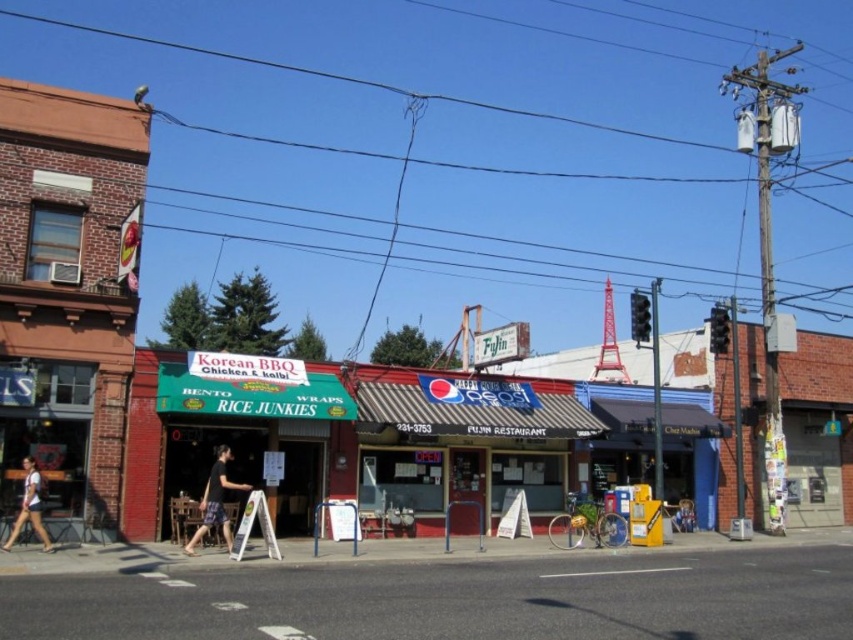
Question: Where is black cotton t-shirt at center located in relation to white cotton shirt at lower left in the image?

Choices:
 (A) below
 (B) above

Answer: (B)

Question: Which of the following is the farthest from the observer?

Choices:
 (A) black wire at upper center
 (B) smooth asphalt road at lower center

Answer: (A)

Question: Can you confirm if smooth asphalt road at lower center is smaller than white cotton shirt at lower left?

Choices:
 (A) yes
 (B) no

Answer: (B)

Question: Does black wire at upper center appear on the left side of white cotton shirt at lower left?

Choices:
 (A) no
 (B) yes

Answer: (A)

Question: Which point is closer to the camera?

Choices:
 (A) smooth asphalt road at lower center
 (B) white cotton shirt at lower left

Answer: (A)

Question: Which of the following is the farthest from the observer?

Choices:
 (A) smooth asphalt road at lower center
 (B) black wire at upper center
 (C) black cotton t-shirt at center

Answer: (B)